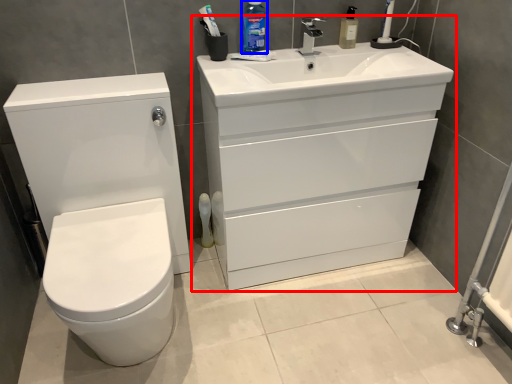
Question: Which object is closer to the camera taking this photo, bathroom cabinet (highlighted by a red box) or cleaning product (highlighted by a blue box)?

Choices:
 (A) bathroom cabinet
 (B) cleaning product

Answer: (A)